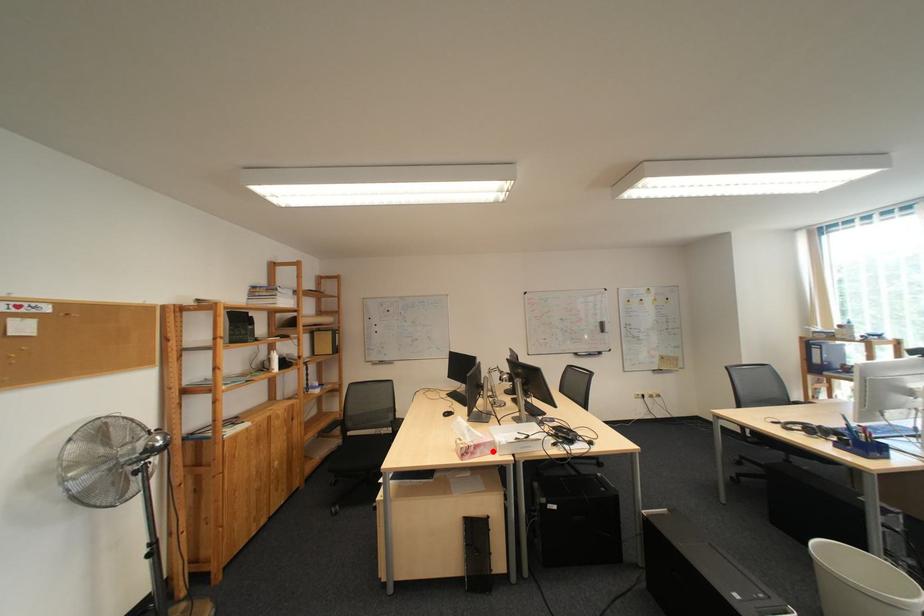
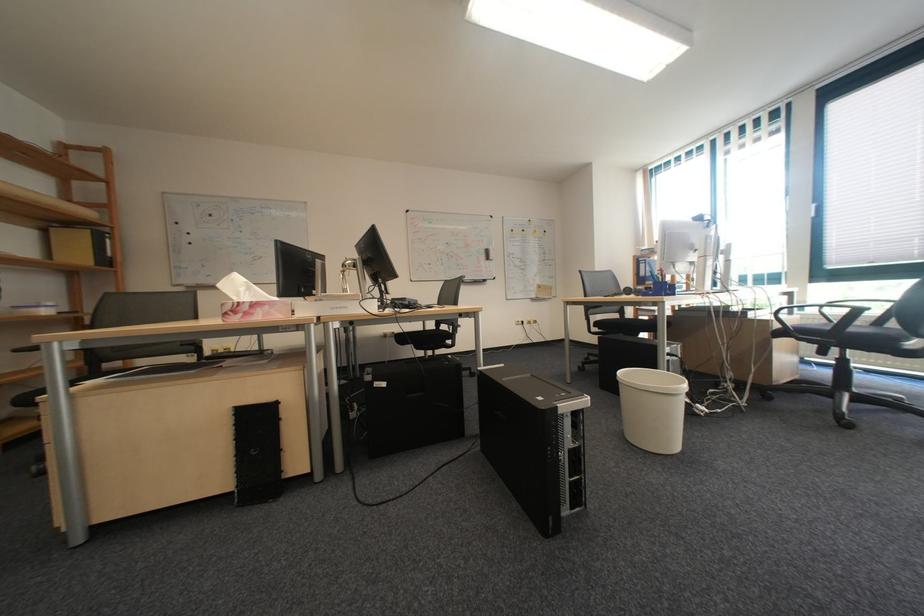
In the second image, find the point that corresponds to the highlighted location in the first image.

(273, 312)